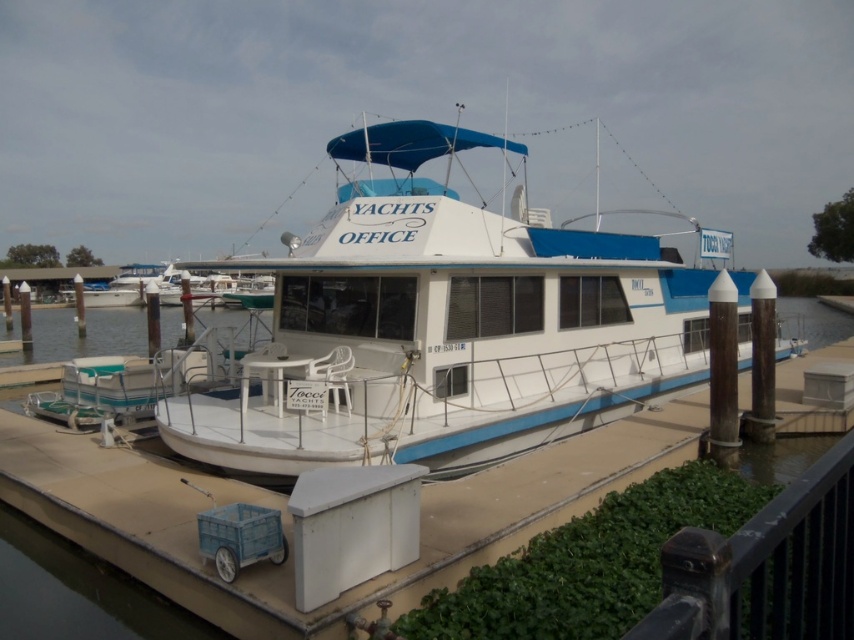
You are standing on the dock and looking at the yacht office. There are two points marked on the boat deck. Which point, point (211, 392) or point (799, 502), is closer to you?

Point (211, 392) is closer to you because it is further to the viewer than point (799, 502).